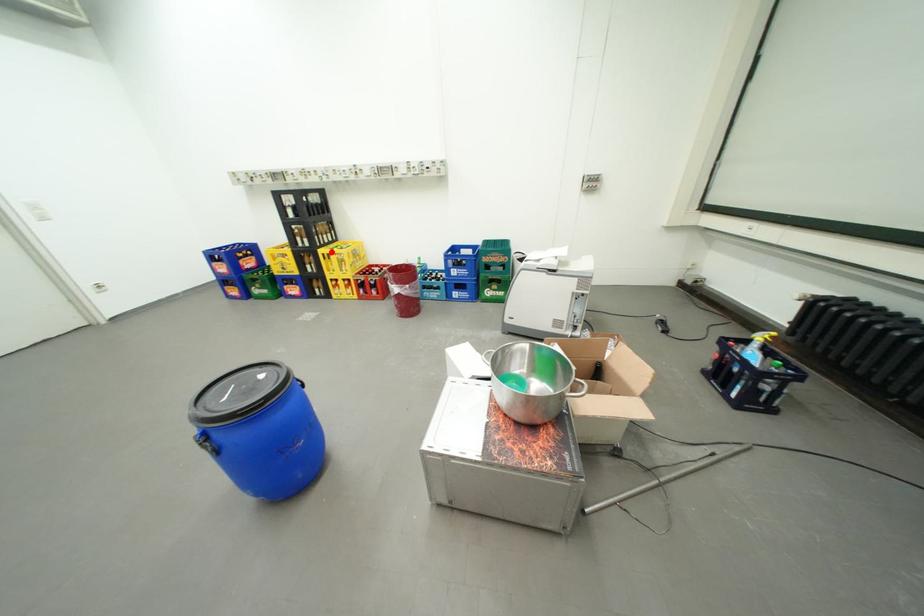
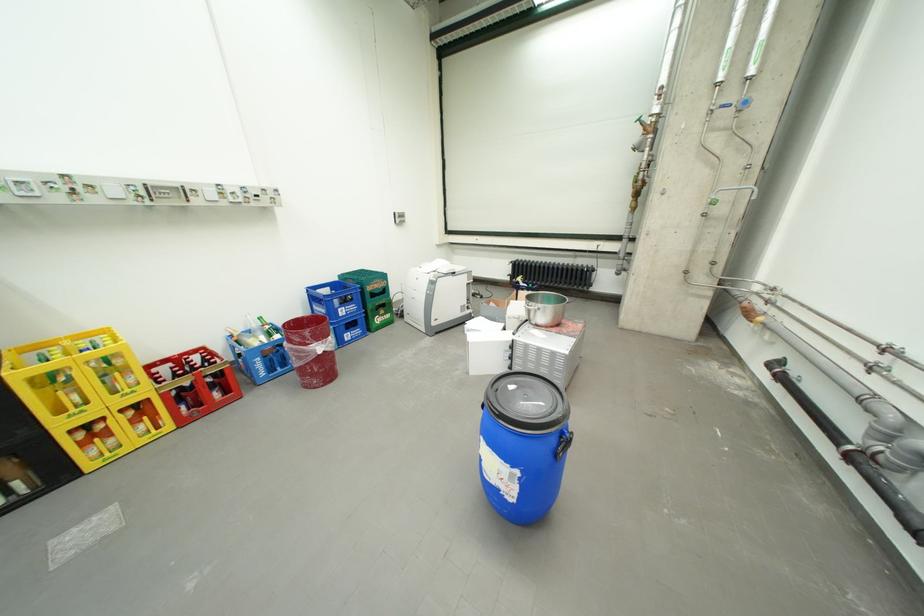
Question: I am providing you with two images of the same scene from different viewpoints. Image1 has a red point marked. In image2, the corresponding 3D location appears at what relative position? Reply with the corresponding letter.

Choices:
 (A) Closer
 (B) Farther

Answer: (B)